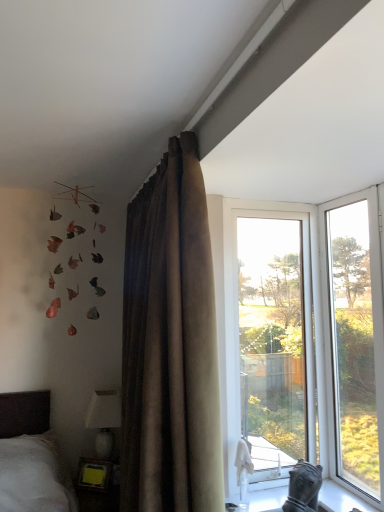
I want to click on blank space above white glossy stone at lower right (from a real-world perspective), so click(x=339, y=496).